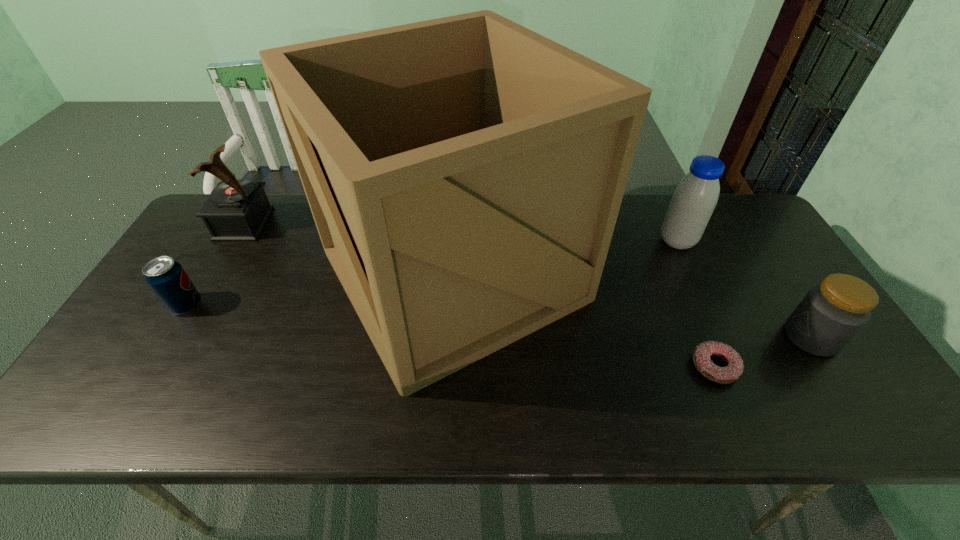
The width and height of the screenshot is (960, 540). Find the location of `vacant space located 0.150m on the right of the soya milk`. vacant space located 0.150m on the right of the soya milk is located at coordinates tap(745, 241).

The height and width of the screenshot is (540, 960). What are the coordinates of `blank space located 0.070m on the surface of the rightmost object near the warning symbol` in the screenshot? It's located at 757,337.

Where is `vacant space located 0.380m on the surface of the rightmost object near the warning symbol`? The height and width of the screenshot is (540, 960). vacant space located 0.380m on the surface of the rightmost object near the warning symbol is located at coordinates (632, 337).

Locate an element on the screen. vacant space located 0.200m on the surface of the rightmost object near the warning symbol is located at coordinates (705, 337).

Locate an element on the screen. vacant space located 0.250m on the back of the soda can is located at coordinates (229, 234).

Image resolution: width=960 pixels, height=540 pixels. I want to click on vacant area located on the left of the doughnut, so click(670, 366).

Find the location of a particular element. Image resolution: width=960 pixels, height=540 pixels. box that is positioned at the far edge is located at coordinates (465, 174).

The height and width of the screenshot is (540, 960). I want to click on phonograph_record present at the far edge, so [x=237, y=210].

At what (x,y) coordinates should I click in order to perform the action: click on soya milk positioned at the far edge. Please return your answer as a coordinate pair (x, y). Looking at the image, I should click on (695, 197).

Image resolution: width=960 pixels, height=540 pixels. Identify the location of object positioned at the near edge. (465, 174).